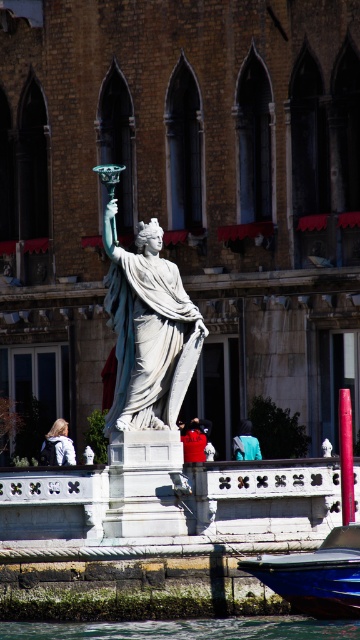
Question: Which object is the farthest from the clear water at lower center?

Choices:
 (A) white marble statue at center
 (B) blue glossy boat at lower center

Answer: (A)

Question: Estimate the real-world distances between objects in this image. Which object is closer to the clear water at lower center?

Choices:
 (A) white marble statue at center
 (B) blue glossy boat at lower center

Answer: (B)

Question: Does clear water at lower center appear on the right side of blue glossy boat at lower center?

Choices:
 (A) yes
 (B) no

Answer: (B)

Question: From the image, what is the correct spatial relationship of clear water at lower center in relation to blue glossy boat at lower center?

Choices:
 (A) right
 (B) left

Answer: (B)

Question: Is white marble statue at center positioned in front of blue glossy boat at lower center?

Choices:
 (A) yes
 (B) no

Answer: (B)

Question: Considering the real-world distances, which object is closest to the blue glossy boat at lower center?

Choices:
 (A) clear water at lower center
 (B) white marble statue at center

Answer: (A)